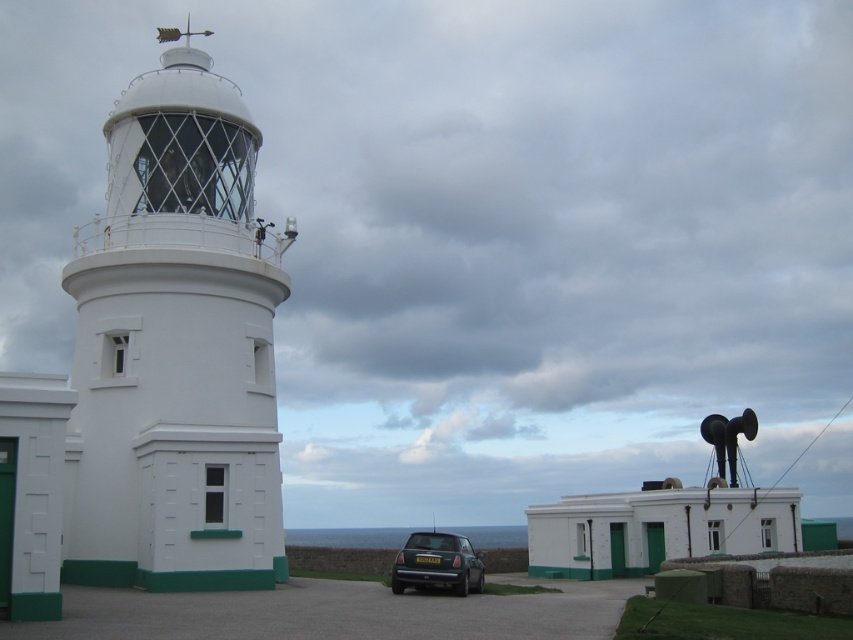
Consider the image. You are driving a metallic gray hatchback at lower center and want to park it closer to the white glass lighthouse at left. Is there enough space between them for another car to pass through?

The white glass lighthouse at left is to the left of the metallic gray hatchback at lower center, so there is space between them for another car to pass through.

You are driving a metallic gray hatchback at lower center and want to park it near the white glass lighthouse at left. Is the lighthouse elevated enough to avoid blocking your view while parking?

The white glass lighthouse at left is above the metallic gray hatchback at lower center, so it is elevated and should not block your view while parking.